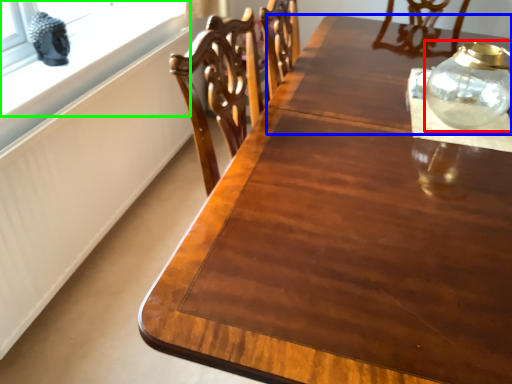
Question: Which object is the closest to the glass vase (highlighted by a red box)? Choose among these: round table (highlighted by a blue box) or window (highlighted by a green box).

Choices:
 (A) round table
 (B) window

Answer: (A)